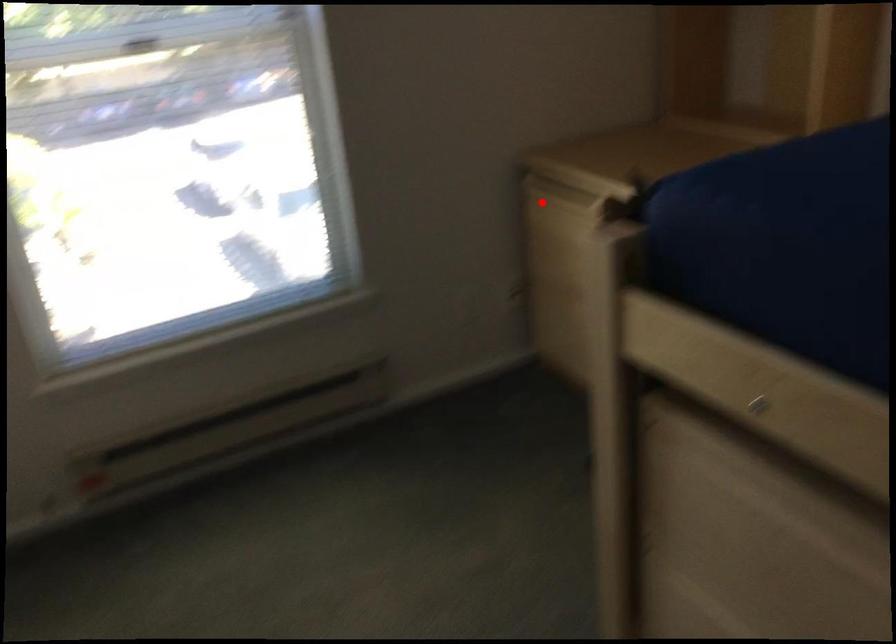
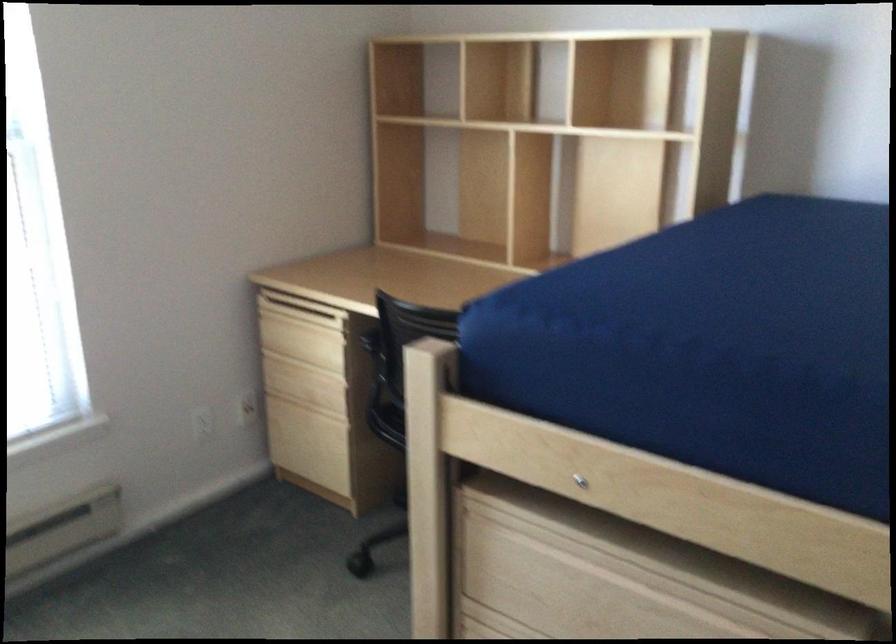
Find the pixel in the second image that matches the highlighted location in the first image.

(285, 319)